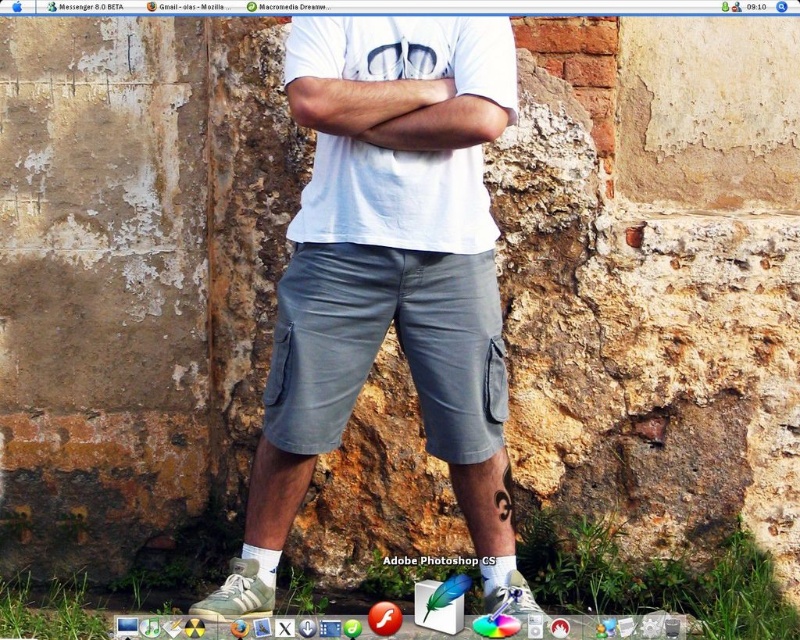
Question: Does gray cotton shorts at center have a larger size compared to white matte t-shirt at center?

Choices:
 (A) no
 (B) yes

Answer: (B)

Question: Among these objects, which one is farthest from the camera?

Choices:
 (A) white matte t-shirt at center
 (B) gray cotton shorts at center

Answer: (B)

Question: Which point is closer to the camera taking this photo?

Choices:
 (A) (416, 99)
 (B) (281, 300)

Answer: (A)

Question: In this image, where is gray cotton shorts at center located relative to white matte t-shirt at center?

Choices:
 (A) above
 (B) below

Answer: (B)

Question: Which of the following is the farthest from the observer?

Choices:
 (A) gray cotton shorts at center
 (B) white matte t-shirt at center

Answer: (A)

Question: Can you confirm if gray cotton shorts at center is positioned to the right of white matte t-shirt at center?

Choices:
 (A) no
 (B) yes

Answer: (A)